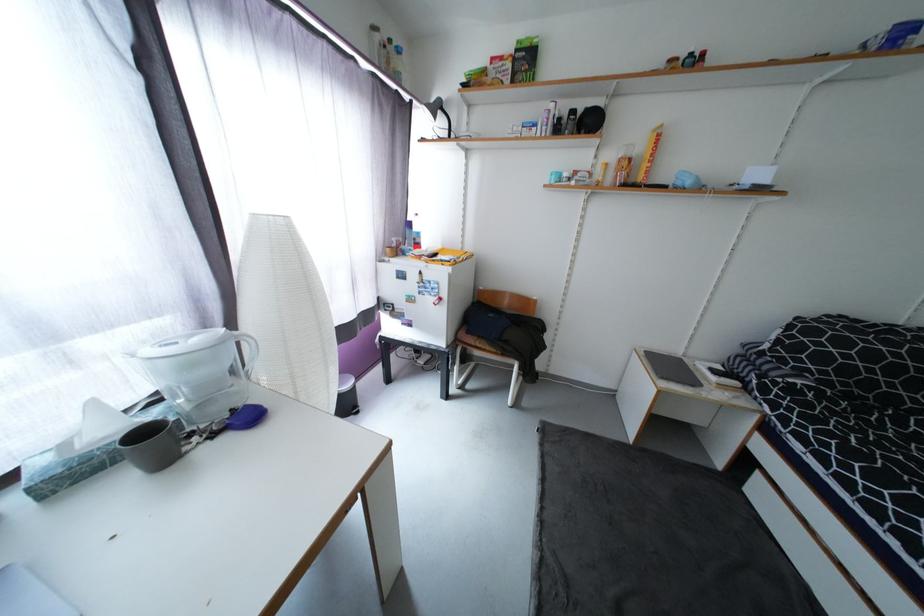
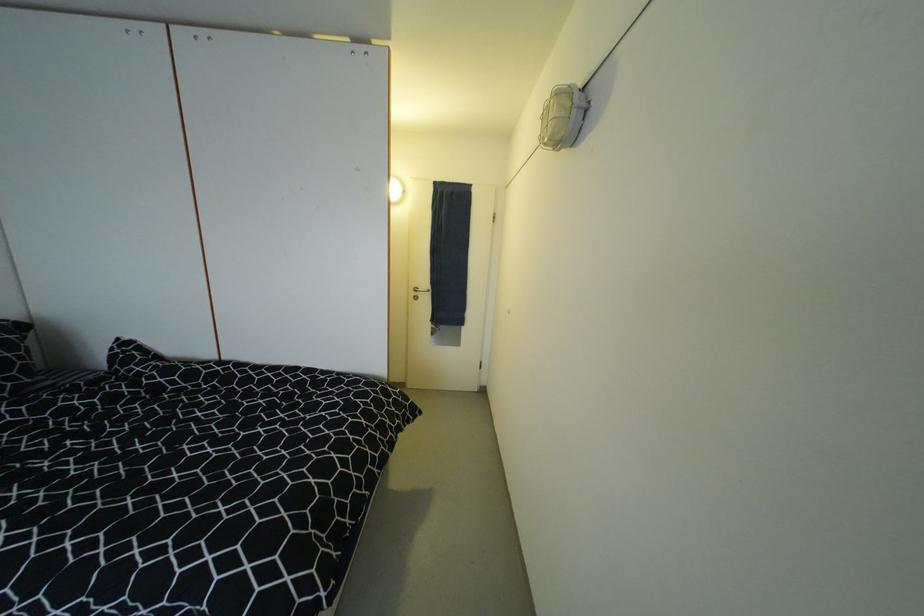
Based on the continuous images, in which direction is the camera rotating?

The camera's rotation is toward right-down.